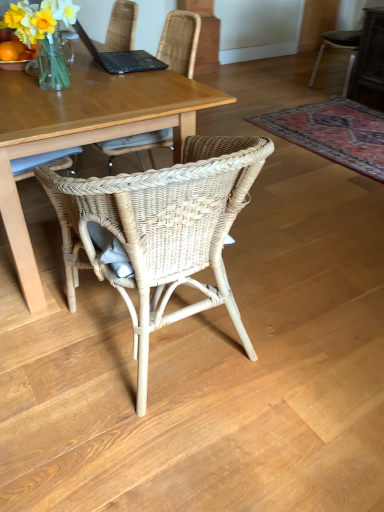
The image size is (384, 512). In order to click on unoccupied region to the right of matte wooden desk at center in this screenshot , I will do `click(301, 232)`.